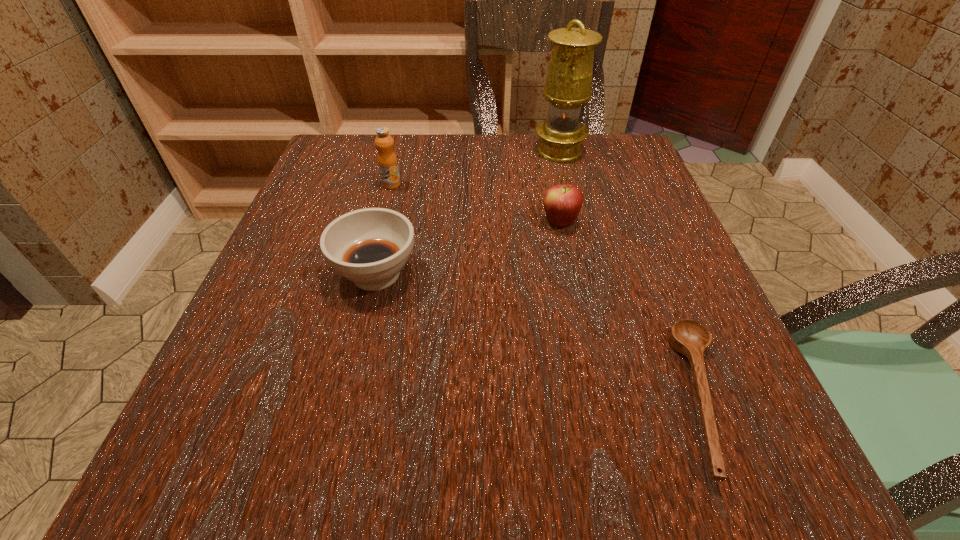
What are the coordinates of `the tallest object` in the screenshot? It's located at (568, 85).

Where is `oil lamp`? This screenshot has width=960, height=540. oil lamp is located at coordinates (568, 85).

At what (x,y) coordinates should I click in order to perform the action: click on the second farthest object. Please return your answer as a coordinate pair (x, y). Image resolution: width=960 pixels, height=540 pixels. Looking at the image, I should click on click(387, 161).

Where is `apple`? This screenshot has width=960, height=540. apple is located at coordinates (562, 203).

This screenshot has height=540, width=960. Identify the location of the second shortest object. (370, 246).

At what (x,y) coordinates should I click in order to perform the action: click on soup bowl. Please return your answer as a coordinate pair (x, y). The width and height of the screenshot is (960, 540). Looking at the image, I should click on (370, 246).

What are the coordinates of `the nearest object` in the screenshot? It's located at (687, 337).

Where is `wooden spoon`? The image size is (960, 540). wooden spoon is located at coordinates (687, 337).

Where is `vacant point located 0.390m on the left of the farthest object`? vacant point located 0.390m on the left of the farthest object is located at coordinates (372, 151).

You are a GUI agent. You are given a task and a screenshot of the screen. Output one action in this format:
    pyautogui.click(x=<x>, y=<y>)
    Task: Click on the vacant area located 0.060m on the front label of the second farthest object
    
    Given the screenshot: What is the action you would take?
    pyautogui.click(x=386, y=206)